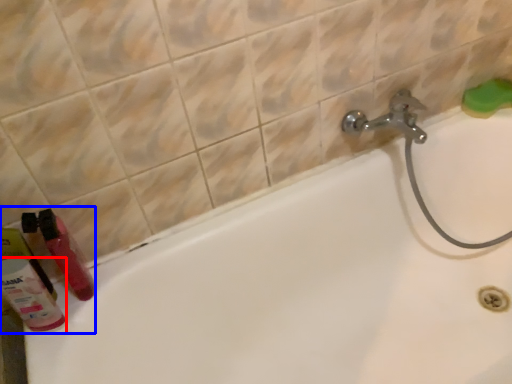
Question: Which object is further to the camera taking this photo, cleaning product (highlighted by a red box) or toiletry (highlighted by a blue box)?

Choices:
 (A) cleaning product
 (B) toiletry

Answer: (B)